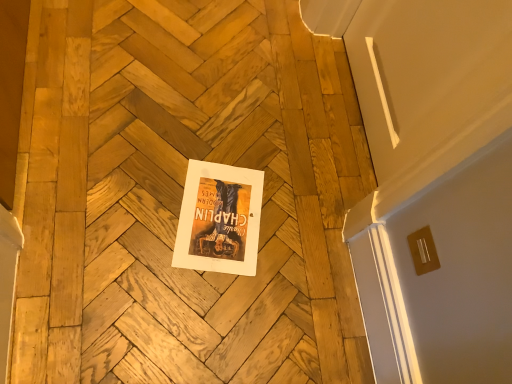
What is the approximate width of natural wood plywood at center?

natural wood plywood at center is 4.02 feet in width.

The image size is (512, 384). In order to click on natural wood plywood at center in this screenshot , I will do `click(180, 204)`.

This screenshot has height=384, width=512. Describe the element at coordinates (180, 204) in the screenshot. I see `natural wood plywood at center` at that location.

This screenshot has width=512, height=384. Find the location of `natural wood plywood at center`. natural wood plywood at center is located at coordinates (180, 204).